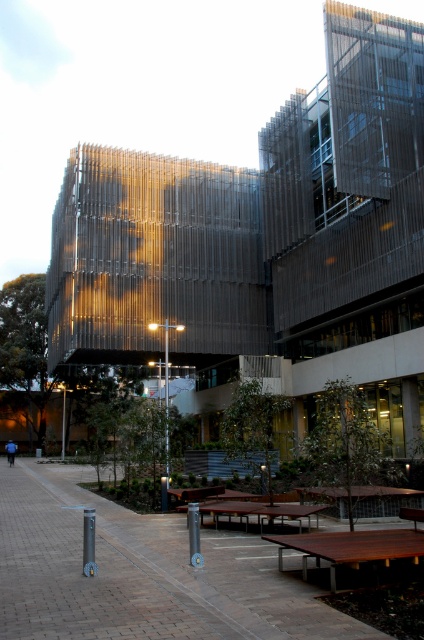
Question: Estimate the real-world distances between objects in this image. Which object is closer to the brown wooden bench at center?

Choices:
 (A) brown wooden tables at center
 (B) wooden picnic table at center
 (C) metallic pole at center
 (D) wooden park bench at center

Answer: (D)

Question: Is the position of metallic pole at center less distant than that of brown wooden bench at center?

Choices:
 (A) yes
 (B) no

Answer: (B)

Question: Does brown wooden tables at center have a smaller size compared to metallic pole at center?

Choices:
 (A) no
 (B) yes

Answer: (B)

Question: Based on their relative distances, which object is farther from the brown wooden tables at center?

Choices:
 (A) wooden park bench at center
 (B) wooden picnic table at center
 (C) metallic pole at center

Answer: (A)

Question: Is brown wooden tables at center behind brown wooden bench at center?

Choices:
 (A) yes
 (B) no

Answer: (B)

Question: Which object is farther from the camera taking this photo?

Choices:
 (A) brown wooden tables at center
 (B) metallic pole at center
 (C) wooden park bench at center

Answer: (B)